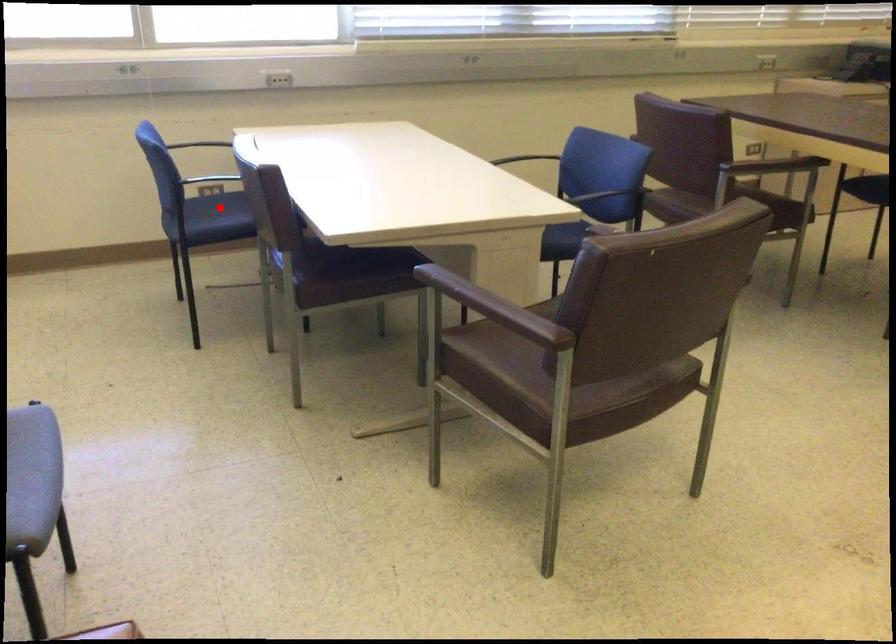
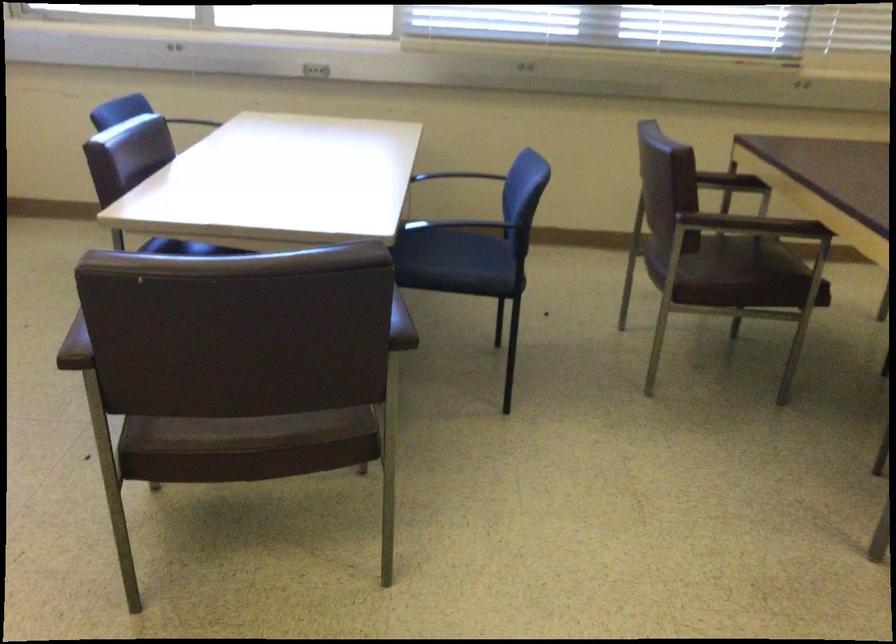
Question: I am providing you with two images of the same scene from different viewpoints. A red point is marked on the first image. At the location where the point appears in image 1, is it still visible in image 2?

Choices:
 (A) Yes
 (B) No

Answer: (B)